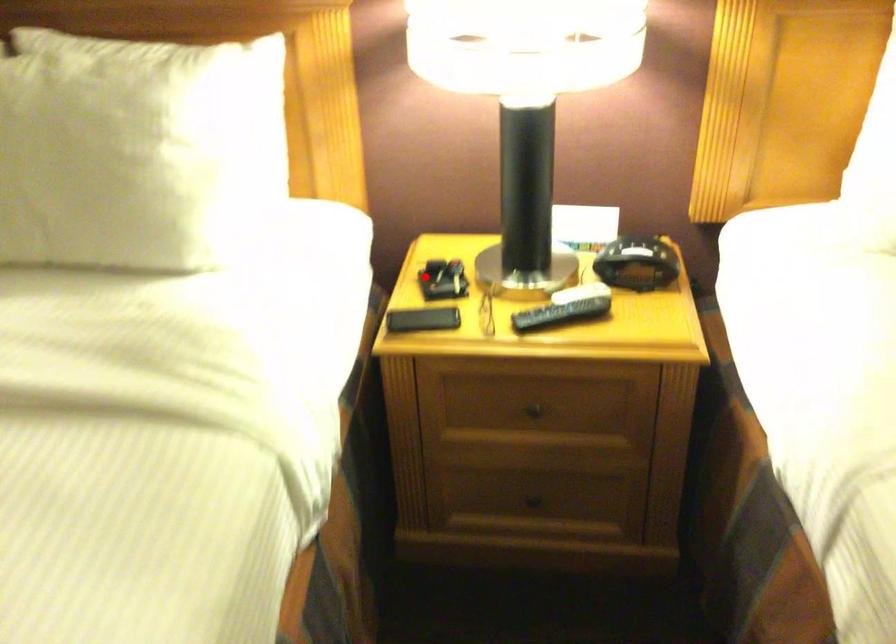
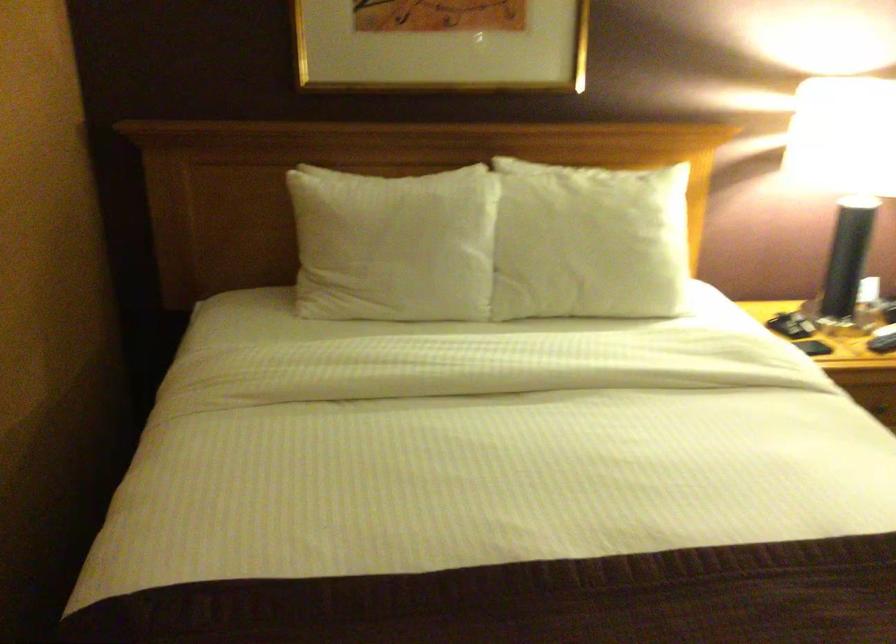
The point at the highlighted location is marked in the first image. Where is the corresponding point in the second image?

(782, 325)